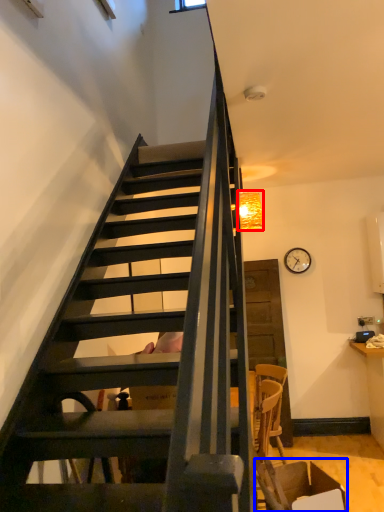
Question: Which point is further to the camera, lamp (highlighted by a red box) or armchair (highlighted by a blue box)?

Choices:
 (A) lamp
 (B) armchair

Answer: (A)